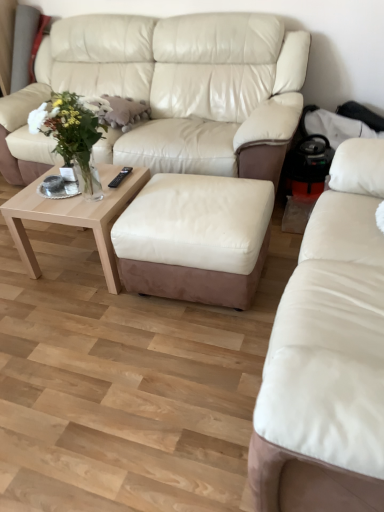
Question: Is white leather ottoman at center to the left of light wood/texture coffee table at lower center from the viewer's perspective?

Choices:
 (A) no
 (B) yes

Answer: (A)

Question: Considering the relative sizes of white leather ottoman at center and light wood/texture coffee table at lower center in the image provided, is white leather ottoman at center wider than light wood/texture coffee table at lower center?

Choices:
 (A) no
 (B) yes

Answer: (B)

Question: Is white leather ottoman at center beside light wood/texture coffee table at lower center?

Choices:
 (A) yes
 (B) no

Answer: (B)

Question: From the image's perspective, would you say white leather ottoman at center is positioned over light wood/texture coffee table at lower center?

Choices:
 (A) no
 (B) yes

Answer: (A)

Question: From a real-world perspective, is white leather ottoman at center on light wood/texture coffee table at lower center?

Choices:
 (A) no
 (B) yes

Answer: (B)

Question: Is translucent glass vase at center to the left or to the right of light wood/texture coffee table at lower center in the image?

Choices:
 (A) left
 (B) right

Answer: (B)

Question: From their relative heights in the image, would you say translucent glass vase at center is taller or shorter than light wood/texture coffee table at lower center?

Choices:
 (A) short
 (B) tall

Answer: (B)

Question: Looking at the image, does translucent glass vase at center seem bigger or smaller compared to light wood/texture coffee table at lower center?

Choices:
 (A) small
 (B) big

Answer: (A)

Question: Is point (72, 148) positioned closer to the camera than point (39, 207)?

Choices:
 (A) farther
 (B) closer

Answer: (B)

Question: From the image's perspective, is light wood/texture coffee table at lower center located above or below leather studio couch at center, which is the 2th studio couch from back to front?

Choices:
 (A) below
 (B) above

Answer: (B)

Question: From a real-world perspective, is light wood/texture coffee table at lower center positioned above or below leather studio couch at center, which is the 2th studio couch from back to front?

Choices:
 (A) below
 (B) above

Answer: (A)

Question: Is point click(117, 205) positioned closer to the camera than point click(264, 371)?

Choices:
 (A) closer
 (B) farther

Answer: (B)

Question: Based on their positions, is light wood/texture coffee table at lower center located to the left or right of leather studio couch at center, which is the 2th studio couch from back to front?

Choices:
 (A) right
 (B) left

Answer: (B)

Question: From the image's perspective, is beige leather couch at upper center, which ranks as the second studio couch in front-to-back order, located above or below translucent glass vase at center?

Choices:
 (A) below
 (B) above

Answer: (B)

Question: Is point (218, 59) positioned closer to the camera than point (87, 194)?

Choices:
 (A) farther
 (B) closer

Answer: (A)